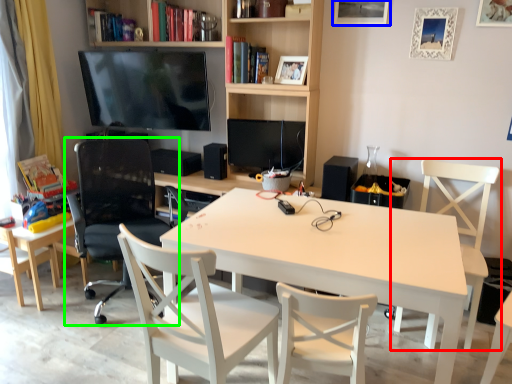
Question: Based on their relative distances, which object is farther from chair (highlighted by a red box)? Choose from picture frame (highlighted by a blue box) and chair (highlighted by a green box).

Choices:
 (A) picture frame
 (B) chair

Answer: (B)